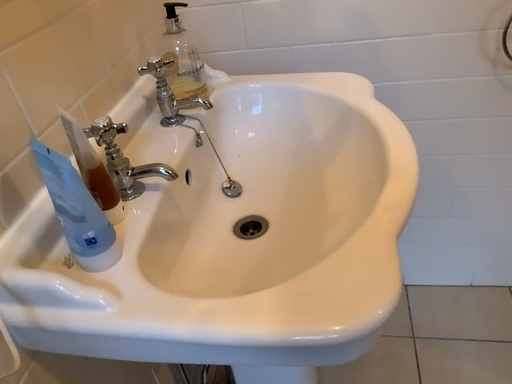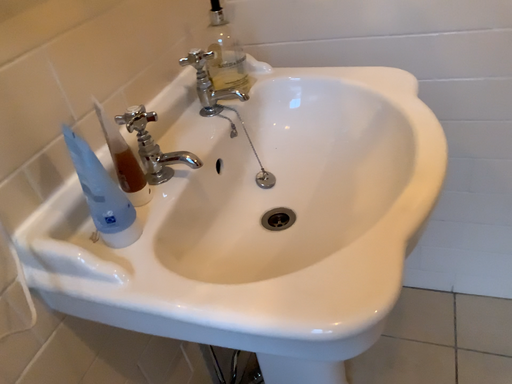
Question: Which way did the camera rotate in the video?

Choices:
 (A) rotated right
 (B) rotated left

Answer: (B)